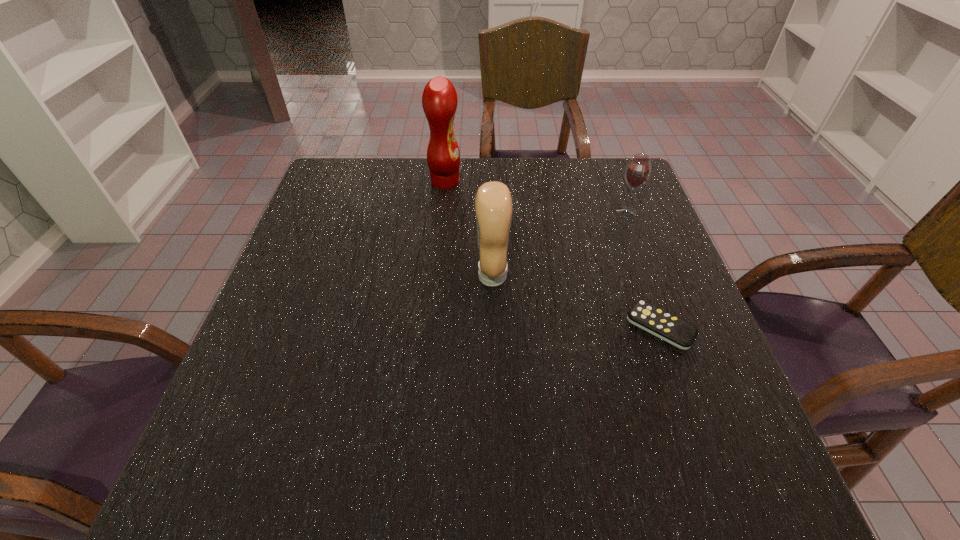
You are a GUI agent. You are given a task and a screenshot of the screen. Output one action in this format:
    pyautogui.click(x=<x>, y=<y>)
    Task: Click on the vacant space at the left edge of the desktop
    This screenshot has width=960, height=540.
    Given the screenshot: What is the action you would take?
    pyautogui.click(x=341, y=236)

Identify the location of free spot at the right edge of the desktop. (701, 333).

I want to click on empty space that is in between the shortest object and the farthest object, so click(x=553, y=254).

I want to click on free space between the wineglass and the right condiment, so click(559, 244).

The image size is (960, 540). Identify the location of unoccupied area between the second tallest object and the third tallest object. (559, 244).

What are the coordinates of `free space that is in between the leftmost object and the third shortest object` in the screenshot? It's located at (468, 228).

Where is `free space between the third farthest object and the shortest object`? The image size is (960, 540). free space between the third farthest object and the shortest object is located at coordinates (x=576, y=301).

Image resolution: width=960 pixels, height=540 pixels. In order to click on free area in between the left condiment and the nearer condiment in this screenshot , I will do `click(468, 228)`.

Locate an element on the screen. free spot between the wineglass and the remote control is located at coordinates 643,269.

This screenshot has height=540, width=960. In order to click on vacant point located between the second object from left to right and the farther condiment in this screenshot , I will do `click(468, 228)`.